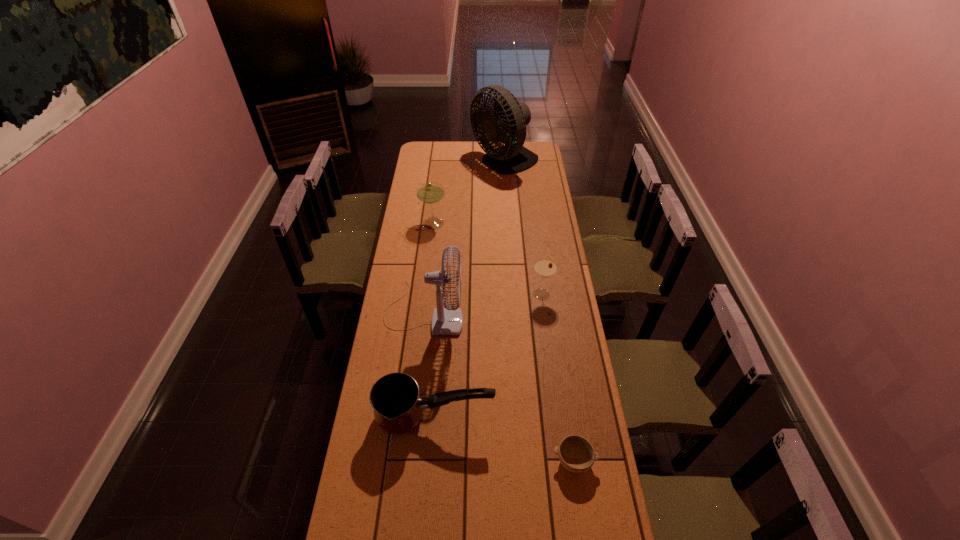
What are the coordinates of `fan at the left edge` in the screenshot? It's located at (445, 321).

This screenshot has height=540, width=960. Identify the location of martini that is at the left edge. (429, 192).

Where is `saucepan positioned at the left edge`? This screenshot has height=540, width=960. saucepan positioned at the left edge is located at coordinates (395, 398).

Locate an element on the screen. fan that is at the right edge is located at coordinates (507, 122).

The image size is (960, 540). Identify the location of martini at the right edge. (544, 267).

Where is `bowl located at the right edge`? The height and width of the screenshot is (540, 960). bowl located at the right edge is located at coordinates (576, 454).

The height and width of the screenshot is (540, 960). What are the coordinates of `object situated at the far right corner` in the screenshot? It's located at (507, 122).

In the image, there is a desktop. Identify the location of vacant space at the left edge. The image size is (960, 540). (407, 440).

Locate an element on the screen. The height and width of the screenshot is (540, 960). vacant space at the right edge of the desktop is located at coordinates (529, 171).

Identify the location of vacant position at the far right corner of the desktop. The height and width of the screenshot is (540, 960). (531, 147).